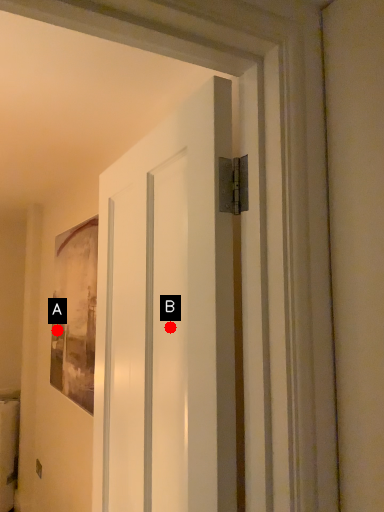
Question: Two points are circled on the image, labeled by A and B beside each circle. Which point is farther to the camera?

Choices:
 (A) A is further
 (B) B is further

Answer: (A)